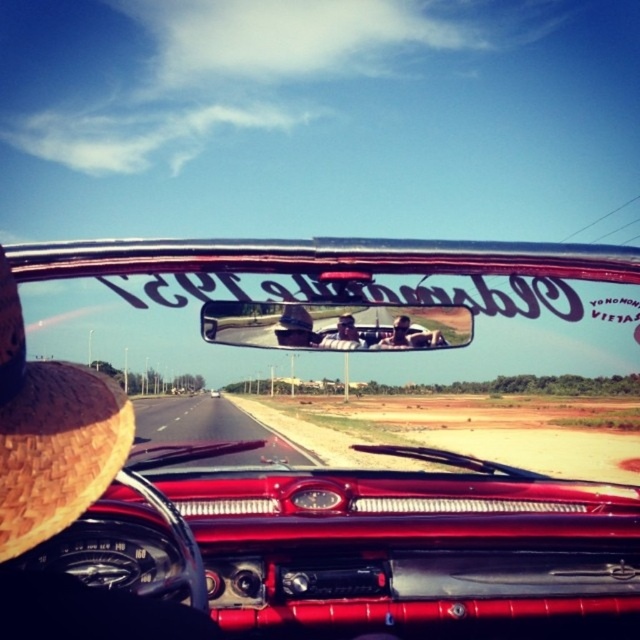
You are a photographer trying to capture the reflection in the metallic chrome rearview mirror at center. You want to ensure that both the brown woven straw hat at left and the reflection of the passengers are clearly visible. Given their sizes, which object might be more challenging to fit into the frame?

The brown woven straw hat at left is larger in size than the metallic chrome rearview mirror at center, so it might be more challenging to fit into the frame since it occupies more space.